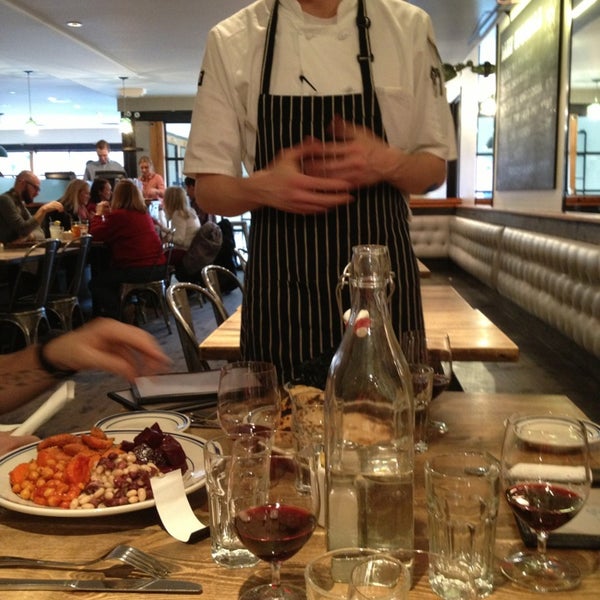
Find the location of `salt shaker`. salt shaker is located at coordinates (343, 528).